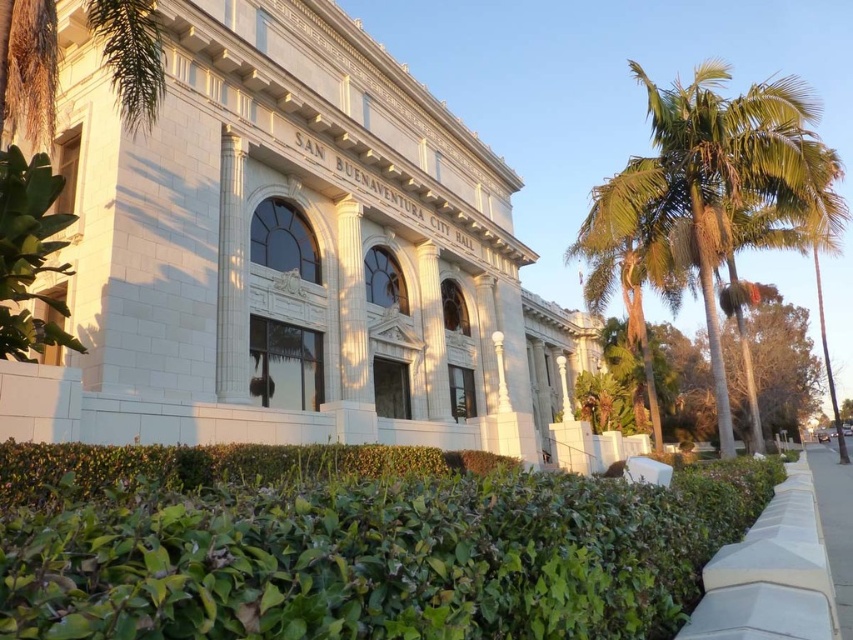
Based on the photo, you are a city planner reviewing the layout of San Buenaventura City Hall. You need to determine if the green leafy tree at right will block the view of the building name from someone standing on the white concrete pavement at lower right. Based on their positions, can you confirm if the tree is in front of or behind the pavement?

The green leafy tree at right is located above the white concrete pavement at lower right, meaning it is positioned in front of the pavement. Therefore, the tree would block the view of the building name for someone standing on the pavement.

You are a visitor approaching the San Buenaventura City Hall and notice the green leafy hedge at lower center and the green leafy tree at right. Which of these two plants is closer to you as you approach the building?

The green leafy hedge at lower center is closer to you because it is positioned in front of the green leafy tree at right.